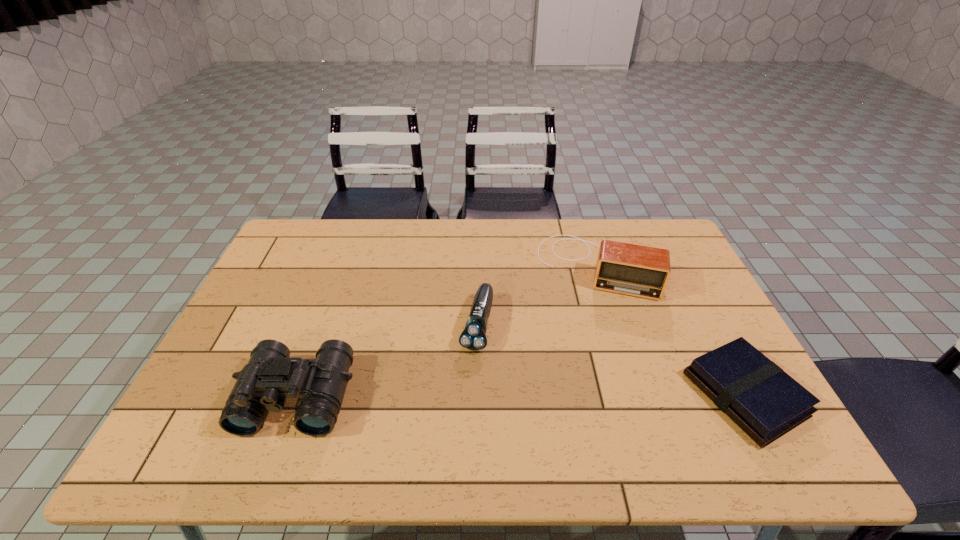
Locate an element on the screen. The image size is (960, 540). vacant region between the leftmost object and the radio receiver is located at coordinates (446, 332).

I want to click on free area in between the binoculars and the electric shaver, so click(387, 361).

Where is `unoccupied position between the book and the second object from left to right`? The image size is (960, 540). unoccupied position between the book and the second object from left to right is located at coordinates (611, 360).

You are a GUI agent. You are given a task and a screenshot of the screen. Output one action in this format:
    pyautogui.click(x=<x>, y=<y>)
    Task: Click on the vacant space in between the third object from right to left and the book
    This screenshot has height=540, width=960.
    Given the screenshot: What is the action you would take?
    pyautogui.click(x=611, y=360)

You are a GUI agent. You are given a task and a screenshot of the screen. Output one action in this format:
    pyautogui.click(x=<x>, y=<y>)
    Task: Click on the free space that is in between the book and the third shortest object
    This screenshot has height=540, width=960.
    Given the screenshot: What is the action you would take?
    pyautogui.click(x=670, y=330)

The width and height of the screenshot is (960, 540). Identify the location of free spot between the shortest object and the leftmost object. tap(520, 396).

Locate an element on the screen. free space that is in between the shortest object and the second tallest object is located at coordinates (670, 330).

You are a GUI agent. You are given a task and a screenshot of the screen. Output one action in this format:
    pyautogui.click(x=<x>, y=<y>)
    Task: Click on the unoccupied area between the tallest object and the second shortest object
    
    Given the screenshot: What is the action you would take?
    pyautogui.click(x=387, y=361)

At what (x,y) coordinates should I click in order to perform the action: click on the closest object to the electric shaver. Please return your answer as a coordinate pair (x, y). The width and height of the screenshot is (960, 540). Looking at the image, I should click on (642, 271).

Point out which object is positioned as the third nearest to the radio receiver. Please provide its 2D coordinates. Your answer should be formatted as a tuple, i.e. [(x, y)], where the tuple contains the x and y coordinates of a point satisfying the conditions above.

[(270, 376)]